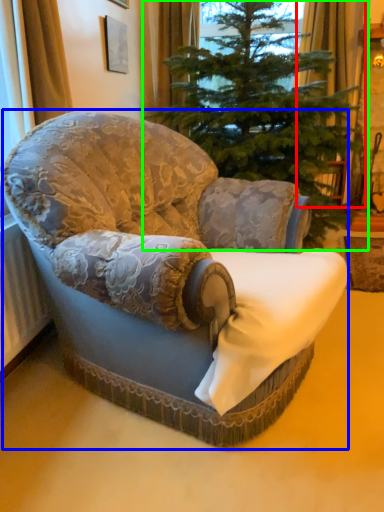
Question: Which object is the farthest from curtain (highlighted by a red box)? Choose among these: chair (highlighted by a blue box) or christmas tree (highlighted by a green box).

Choices:
 (A) chair
 (B) christmas tree

Answer: (A)